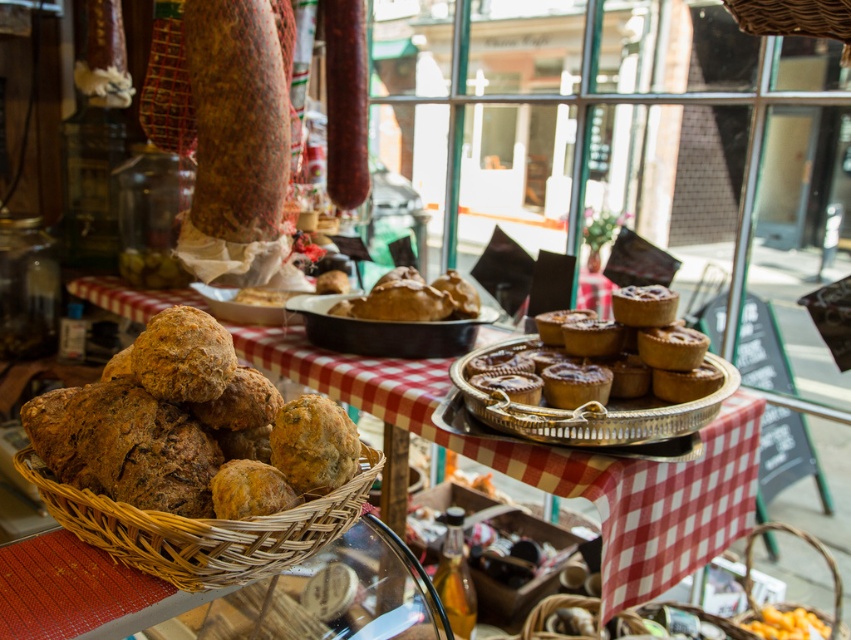
Does wooden tray at center have a greater height compared to golden brown pastry at center?

Yes.

Which of these two, wooden tray at center or golden brown pastry at center, stands shorter?

golden brown pastry at center is shorter.

The width and height of the screenshot is (851, 640). Describe the element at coordinates (563, 461) in the screenshot. I see `wooden tray at center` at that location.

Find the location of a particular element. The height and width of the screenshot is (640, 851). wooden tray at center is located at coordinates (563, 461).

Who is higher up, brown rustic bread at lower left or golden brown pastry at center?

golden brown pastry at center is above.

How far apart are brown rustic bread at lower left and golden brown pastry at center?

A distance of 31.40 inches exists between brown rustic bread at lower left and golden brown pastry at center.

Is point (50, 413) behind point (683, 372)?

No, it is in front of (683, 372).

What are the coordinates of `brown rustic bread at lower left` in the screenshot? It's located at (189, 428).

Does wooden tray at center have a greater height compared to woven brown basket at lower right?

Indeed, wooden tray at center has a greater height compared to woven brown basket at lower right.

Image resolution: width=851 pixels, height=640 pixels. Find the location of `wooden tray at center`. wooden tray at center is located at coordinates (563, 461).

Find the location of a particular element. wooden tray at center is located at coordinates (563, 461).

Locate an element on the screen. This screenshot has width=851, height=640. wooden tray at center is located at coordinates (563, 461).